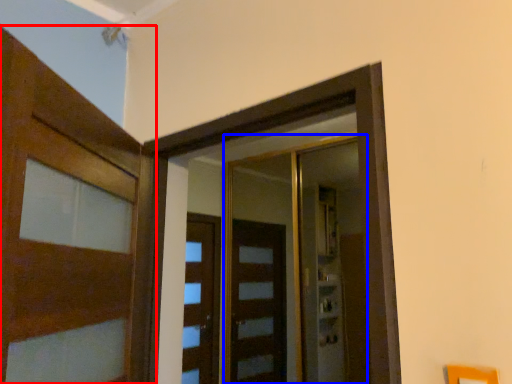
Question: Which of the following is the farthest to the observer, door (highlighted by a red box) or elevator (highlighted by a blue box)?

Choices:
 (A) door
 (B) elevator

Answer: (B)